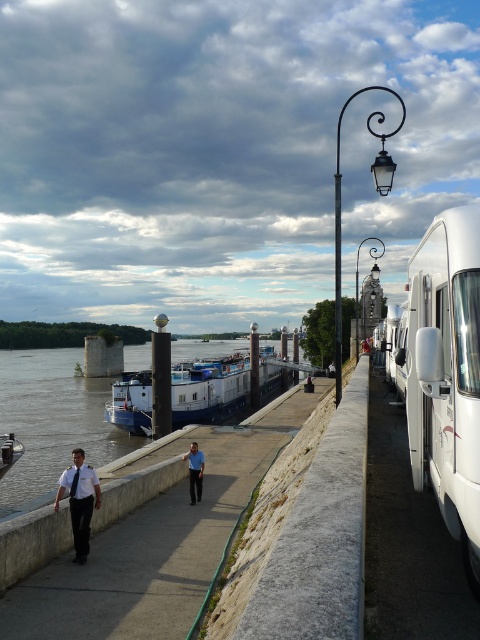
You are standing at the camera position and want to take a photo of the blue matte barge at center. If your camera has a maximum zoom range of 100 feet, can you capture the barge without moving closer?

The blue matte barge at center and camera are 102.63 feet apart from each other. Since the maximum zoom is 100 feet, you cannot capture the barge without moving closer.

You are standing at the point marked by the coordinates (210, 388) in the image. What object are you directly at?

You are directly at the blue matte barge at center located at point (210, 388).